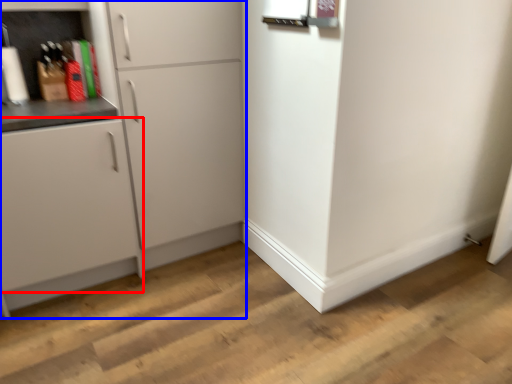
Question: Which object appears closest to the camera in this image, cabinetry (highlighted by a red box) or cabinetry (highlighted by a blue box)?

Choices:
 (A) cabinetry
 (B) cabinetry

Answer: (A)